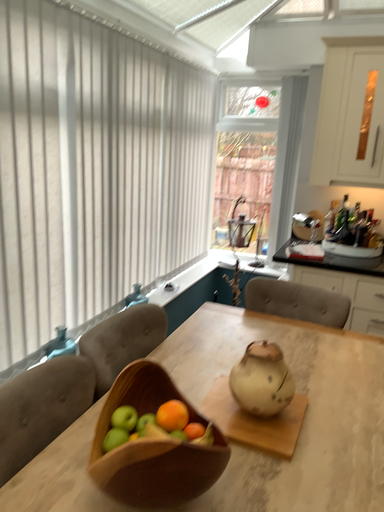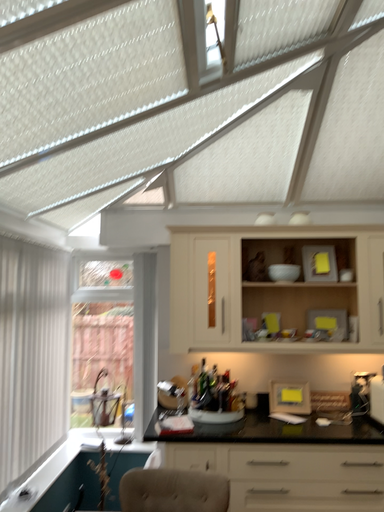
Question: How did the camera likely rotate when shooting the video?

Choices:
 (A) rotated right
 (B) rotated left

Answer: (A)